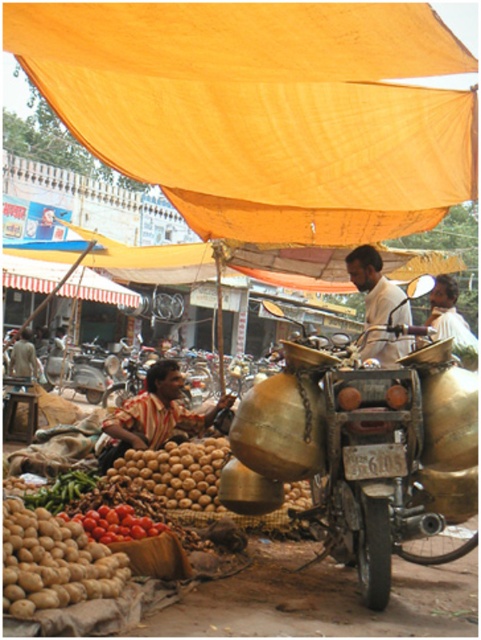
You are a customer at the market and want to locate the vendor wearing the white matte shirt at center. Based on the coordinates provided, where should you look in the image?

The white matte shirt at center is located at coordinates point [376,288] in the image.